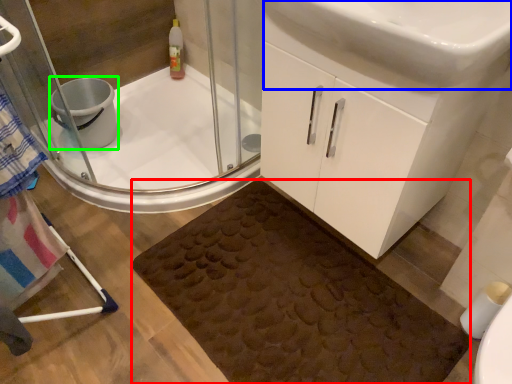
Question: Which object is positioned closest to bath mat (highlighted by a red box)? Select from sink (highlighted by a blue box) and toilet bowl (highlighted by a green box).

Choices:
 (A) sink
 (B) toilet bowl

Answer: (A)